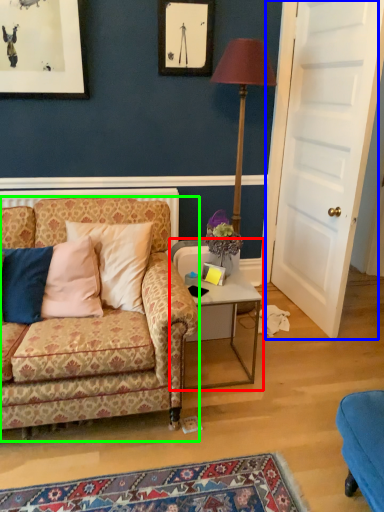
Question: Based on their relative distances, which object is farther from table (highlighted by a red box)? Choose from door (highlighted by a blue box) and studio couch (highlighted by a green box).

Choices:
 (A) door
 (B) studio couch

Answer: (A)